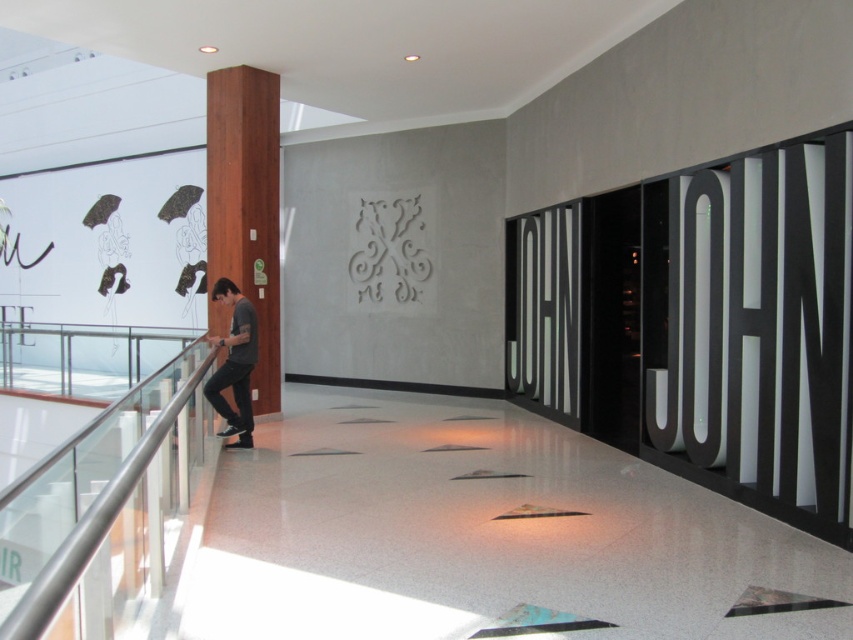
Question: Is silver metallic railing at left positioned behind dark gray t-shirt at center?

Choices:
 (A) yes
 (B) no

Answer: (B)

Question: Does wooden pillar at left have a greater width compared to dark gray t-shirt at center?

Choices:
 (A) yes
 (B) no

Answer: (A)

Question: Which point is farther to the camera?

Choices:
 (A) (47, 637)
 (B) (227, 364)
 (C) (228, 170)

Answer: (C)

Question: Which of these objects is positioned farthest from the wooden pillar at left?

Choices:
 (A) dark gray t-shirt at center
 (B) silver metallic railing at left

Answer: (B)

Question: Which point is farther to the camera?

Choices:
 (A) dark gray t-shirt at center
 (B) silver metallic railing at left

Answer: (A)

Question: Is silver metallic railing at left positioned at the back of wooden pillar at left?

Choices:
 (A) yes
 (B) no

Answer: (B)